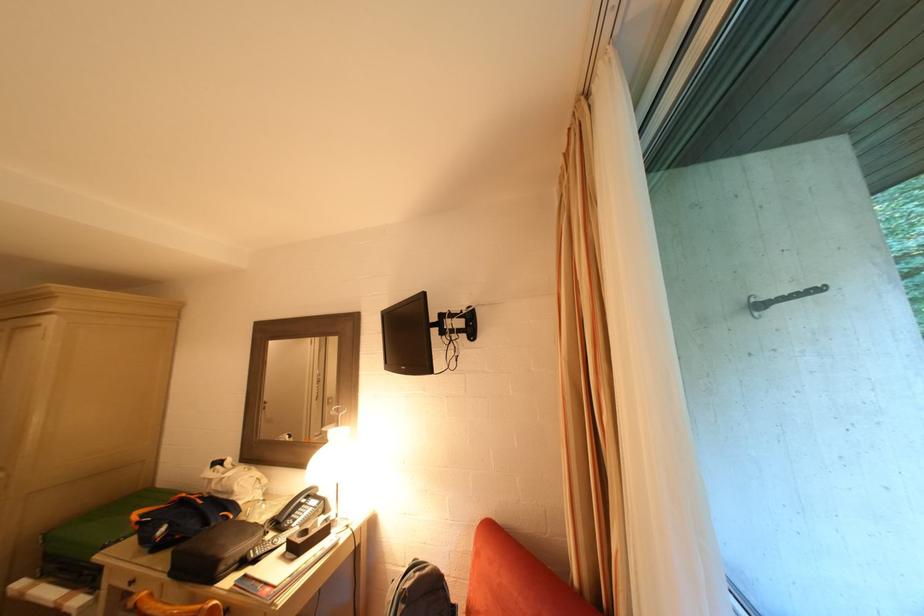
Where is `black shutter latch`? black shutter latch is located at coordinates (419, 334).